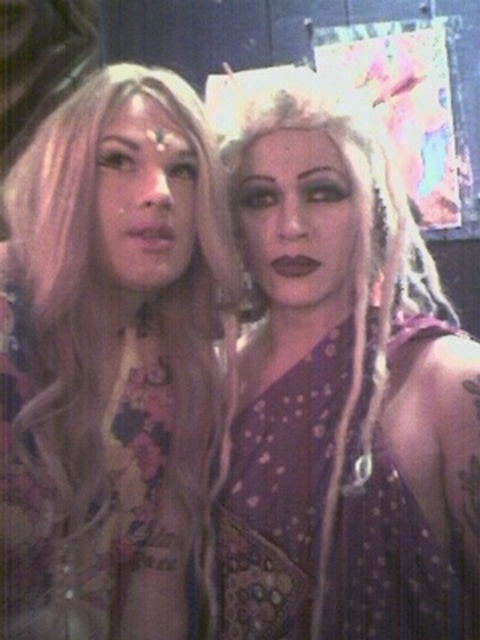
Does matte purple dress at center have a lesser height compared to blonde hair at center?

Indeed, matte purple dress at center has a lesser height compared to blonde hair at center.

Image resolution: width=480 pixels, height=640 pixels. Describe the element at coordinates (343, 387) in the screenshot. I see `matte purple dress at center` at that location.

Which is in front, point (452, 500) or point (163, 285)?

Positioned in front is point (452, 500).

The image size is (480, 640). In order to click on matte purple dress at center in this screenshot , I will do `click(343, 387)`.